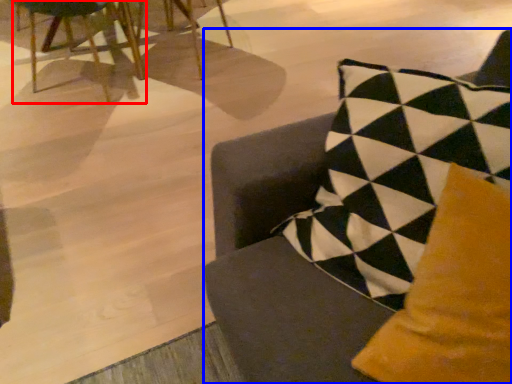
Question: Which point is further to the camera, chair (highlighted by a red box) or chair (highlighted by a blue box)?

Choices:
 (A) chair
 (B) chair

Answer: (A)